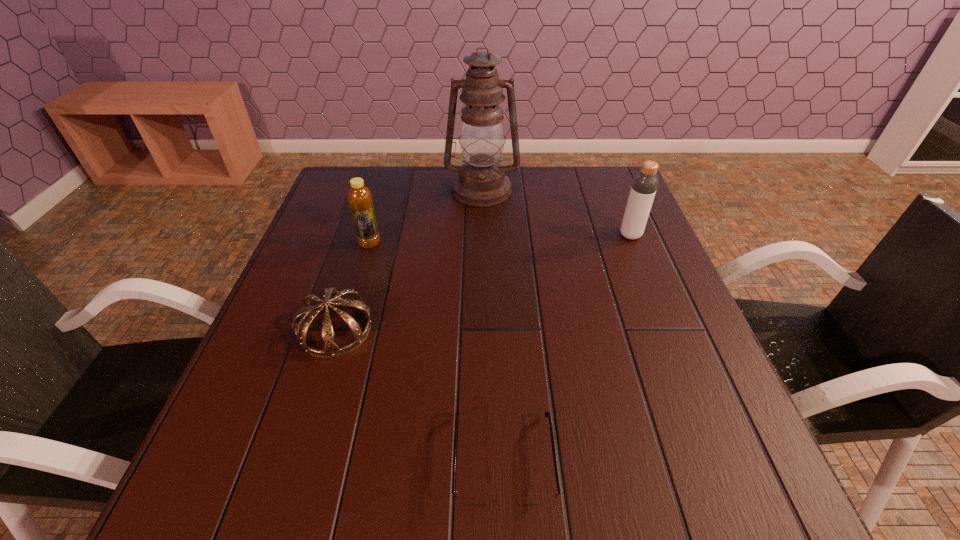
Find the location of `blank area located 0.300m on the front of the left bottle`. blank area located 0.300m on the front of the left bottle is located at coordinates (341, 343).

The width and height of the screenshot is (960, 540). In order to click on free spot located 0.230m on the front of the tiara in this screenshot , I will do `click(290, 477)`.

The height and width of the screenshot is (540, 960). Find the location of `object that is at the far edge`. object that is at the far edge is located at coordinates (481, 182).

Locate an element on the screen. This screenshot has width=960, height=540. object at the near edge is located at coordinates (466, 500).

Identify the location of bottle that is positioned at the left edge. (360, 200).

The width and height of the screenshot is (960, 540). What are the coordinates of `tiara located at the left edge` in the screenshot? It's located at (332, 298).

Locate an element on the screen. object at the right edge is located at coordinates (645, 183).

Find the location of a particular element. This screenshot has width=960, height=540. free region at the far edge of the desktop is located at coordinates (541, 180).

Find the location of a particular element. This screenshot has width=960, height=540. vacant space at the left edge of the desktop is located at coordinates (337, 343).

In the image, there is a desktop. Where is `vacant space at the right edge`? The height and width of the screenshot is (540, 960). vacant space at the right edge is located at coordinates (709, 446).